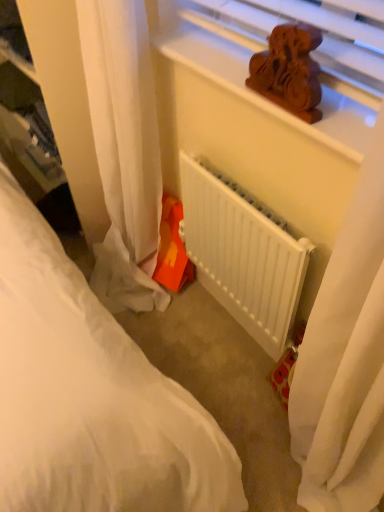
What are the coordinates of `free space in front of white sheer curtain at lower left` in the screenshot? It's located at (180, 349).